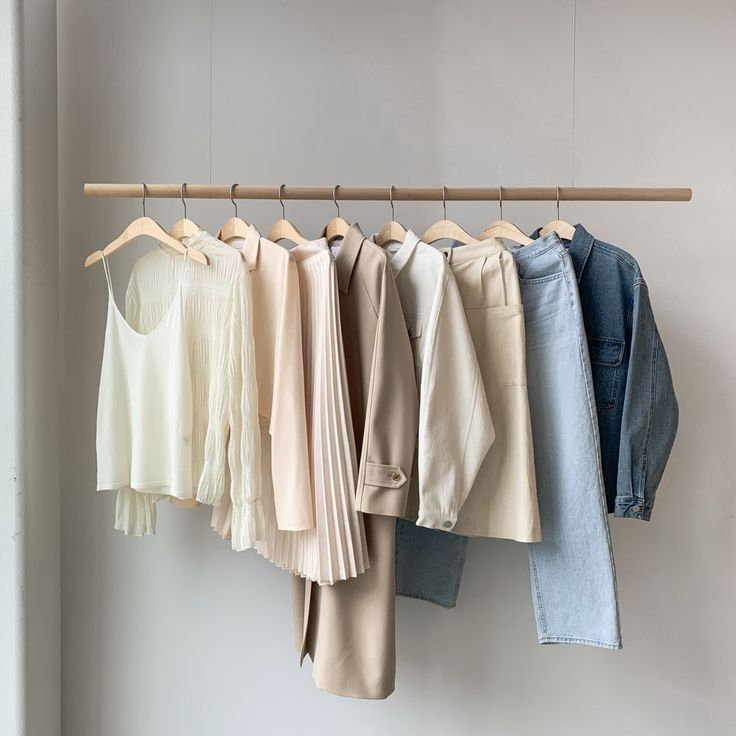
Find the location of a particular element. This screenshot has height=736, width=736. hanger hook is located at coordinates (145, 208), (184, 207), (233, 202), (282, 201), (335, 201), (391, 202), (442, 201), (500, 202), (558, 204).